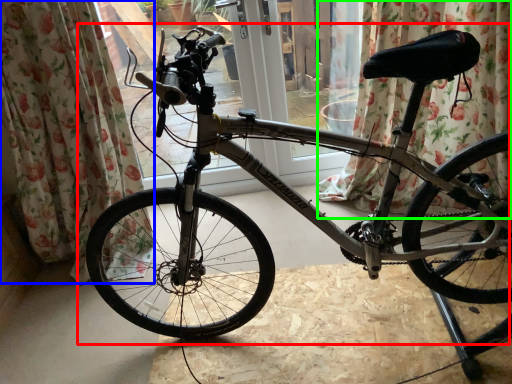
Question: Estimate the real-world distances between objects in this image. Which object is closer to bicycle (highlighted by a red box), curtain (highlighted by a blue box) or curtain (highlighted by a green box)?

Choices:
 (A) curtain
 (B) curtain

Answer: (A)